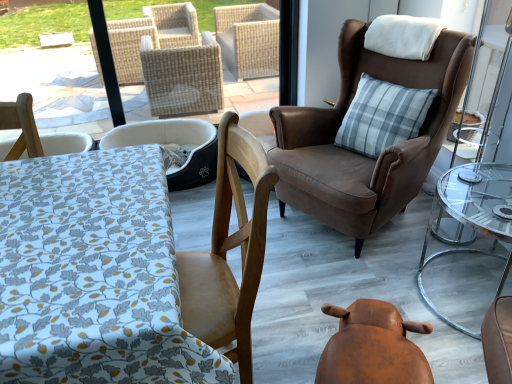
What do you see at coordinates (360, 154) in the screenshot? I see `brown suede armchair at upper right, which is counted as the 1th chair, starting from the right` at bounding box center [360, 154].

Locate an element on the screen. This screenshot has height=384, width=512. brown suede armchair at upper right, the 3th chair viewed from the left is located at coordinates (360, 154).

What are the coordinates of `clear glass table at right` in the screenshot? It's located at (473, 216).

At what (x,y) coordinates should I click in order to perform the action: click on white fabric pet bed at center, the third chair viewed from the right. Please return your answer as a coordinate pair (x, y). Looking at the image, I should click on (174, 143).

Identify the location of brown leather swivel chair at lower center. The height and width of the screenshot is (384, 512). (372, 347).

Describe the element at coordinates (382, 116) in the screenshot. I see `gray plaid pillow at upper right` at that location.

The width and height of the screenshot is (512, 384). I want to click on brown suede armchair at upper right, which is counted as the 1th chair, starting from the right, so tap(360, 154).

Looking at this image, in the image, is brown leather swivel chair at lower center on the left side or the right side of clear glass table at right?

Clearly, brown leather swivel chair at lower center is on the left of clear glass table at right in the image.

Identify the location of table that is behind the brown leather swivel chair at lower center. This screenshot has width=512, height=384. (473, 216).

Which of these two, brown leather swivel chair at lower center or clear glass table at right, is wider?

Wider between the two is clear glass table at right.

Does brown leather swivel chair at lower center have a smaller size compared to clear glass table at right?

Yes.

This screenshot has height=384, width=512. Find the location of `the 2nd chair behind the wooden chair at left, acting as the 2th chair starting from the right`. the 2nd chair behind the wooden chair at left, acting as the 2th chair starting from the right is located at coordinates (174, 143).

How far apart are wooden chair at left, which is the 2th chair from left to right, and white fabric pet bed at center, acting as the first chair starting from the left?

wooden chair at left, which is the 2th chair from left to right, and white fabric pet bed at center, acting as the first chair starting from the left, are 33.97 inches apart.

Is wooden chair at left, acting as the 2th chair starting from the right, touching white fabric pet bed at center, the third chair viewed from the right?

There is a gap between wooden chair at left, acting as the 2th chair starting from the right, and white fabric pet bed at center, the third chair viewed from the right.

Where is `chair that is the 1st one when counting upward from the clear glass table at right (from the image's perspective)`? This screenshot has width=512, height=384. chair that is the 1st one when counting upward from the clear glass table at right (from the image's perspective) is located at coordinates (174, 143).

How much distance is there between clear glass table at right and white fabric pet bed at center, acting as the first chair starting from the left?

A distance of 4.57 feet exists between clear glass table at right and white fabric pet bed at center, acting as the first chair starting from the left.

Does clear glass table at right lie behind white fabric pet bed at center, acting as the first chair starting from the left?

No, the depth of clear glass table at right is less than that of white fabric pet bed at center, acting as the first chair starting from the left.

Could you tell me if gray plaid pillow at upper right is turned towards white fabric pet bed at center, acting as the first chair starting from the left?

No, gray plaid pillow at upper right is not facing towards white fabric pet bed at center, acting as the first chair starting from the left.

From a real-world perspective, which is physically above, gray plaid pillow at upper right or white fabric pet bed at center, acting as the first chair starting from the left?

From a 3D spatial view, gray plaid pillow at upper right is above.

Considering the relative sizes of gray plaid pillow at upper right and white fabric pet bed at center, acting as the first chair starting from the left, in the image provided, is gray plaid pillow at upper right smaller than white fabric pet bed at center, acting as the first chair starting from the left,?

Indeed, gray plaid pillow at upper right has a smaller size compared to white fabric pet bed at center, acting as the first chair starting from the left.

Is gray plaid pillow at upper right not within white fabric pet bed at center, acting as the first chair starting from the left?

Yes.

Considering the relative sizes of white fabric pet bed at center, the third chair viewed from the right, and gray plaid pillow at upper right in the image provided, is white fabric pet bed at center, the third chair viewed from the right, wider than gray plaid pillow at upper right?

Correct, the width of white fabric pet bed at center, the third chair viewed from the right, exceeds that of gray plaid pillow at upper right.

Is white fabric pet bed at center, acting as the first chair starting from the left, to the left or to the right of gray plaid pillow at upper right in the image?

Based on their positions, white fabric pet bed at center, acting as the first chair starting from the left, is located to the left of gray plaid pillow at upper right.

Is white fabric pet bed at center, acting as the first chair starting from the left, taller or shorter than gray plaid pillow at upper right?

Considering their sizes, white fabric pet bed at center, acting as the first chair starting from the left, has less height than gray plaid pillow at upper right.

You are a GUI agent. You are given a task and a screenshot of the screen. Output one action in this format:
    pyautogui.click(x=<x>, y=<y>)
    Task: Click on the pillow in front of the white fabric pet bed at center, the third chair viewed from the right
    The image size is (512, 384).
    Given the screenshot: What is the action you would take?
    pyautogui.click(x=382, y=116)

Is there a large distance between white fabric pet bed at center, acting as the first chair starting from the left, and brown suede armchair at upper right, the 3th chair viewed from the left?

No, there isn't a large distance between white fabric pet bed at center, acting as the first chair starting from the left, and brown suede armchair at upper right, the 3th chair viewed from the left.

Does point (140, 126) appear closer or farther from the camera than point (320, 204)?

Point (140, 126) is positioned farther from the camera compared to point (320, 204).

From the image's perspective, which is above, white fabric pet bed at center, the third chair viewed from the right, or brown suede armchair at upper right, which is counted as the 1th chair, starting from the right?

From the image's view, brown suede armchair at upper right, which is counted as the 1th chair, starting from the right, is above.

Is white fabric pet bed at center, acting as the first chair starting from the left, to the left or to the right of brown suede armchair at upper right, which is counted as the 1th chair, starting from the right, in the image?

In the image, white fabric pet bed at center, acting as the first chair starting from the left, appears on the left side of brown suede armchair at upper right, which is counted as the 1th chair, starting from the right.

Who is more distant, brown suede armchair at upper right, which is counted as the 1th chair, starting from the right, or gray plaid pillow at upper right?

gray plaid pillow at upper right is behind.

Based on the photo, from a real-world perspective, between brown suede armchair at upper right, which is counted as the 1th chair, starting from the right, and gray plaid pillow at upper right, who is vertically higher?

gray plaid pillow at upper right, from a real-world perspective.

Does brown suede armchair at upper right, which is counted as the 1th chair, starting from the right, turn towards gray plaid pillow at upper right?

Yes, brown suede armchair at upper right, which is counted as the 1th chair, starting from the right, faces towards gray plaid pillow at upper right.

Locate an element on the screen. swivel chair located underneath the clear glass table at right (from a real-world perspective) is located at coordinates (372, 347).

What are the coordinates of `chair that is on the left side of wooden chair at left, which is the 2th chair from left to right` in the screenshot? It's located at (174, 143).

From the image, which object appears to be farther from brown suede armchair at upper right, which is counted as the 1th chair, starting from the right, wooden chair at left, which is the 2th chair from left to right, or clear glass table at right?

Among the two, wooden chair at left, which is the 2th chair from left to right, is located further to brown suede armchair at upper right, which is counted as the 1th chair, starting from the right.

Based on their spatial positions, is gray plaid pillow at upper right or brown leather swivel chair at lower center closer to white fabric pet bed at center, acting as the first chair starting from the left?

gray plaid pillow at upper right.

Looking at the image, which one is located further to brown leather swivel chair at lower center, brown suede armchair at upper right, the 3th chair viewed from the left, or clear glass table at right?

Among the two, brown suede armchair at upper right, the 3th chair viewed from the left, is located further to brown leather swivel chair at lower center.

Looking at the image, which one is located further to brown suede armchair at upper right, the 3th chair viewed from the left, brown leather swivel chair at lower center or clear glass table at right?

brown leather swivel chair at lower center is positioned further to the anchor brown suede armchair at upper right, the 3th chair viewed from the left.

From the image, which object appears to be nearer to clear glass table at right, white fabric pet bed at center, the third chair viewed from the right, or wooden chair at left, which is the 2th chair from left to right?

wooden chair at left, which is the 2th chair from left to right, is closer to clear glass table at right.

From the image, which object appears to be farther from clear glass table at right, brown suede armchair at upper right, which is counted as the 1th chair, starting from the right, or white fabric pet bed at center, acting as the first chair starting from the left?

white fabric pet bed at center, acting as the first chair starting from the left, is positioned further to the anchor clear glass table at right.

Considering their positions, is wooden chair at left, acting as the 2th chair starting from the right, positioned closer to gray plaid pillow at upper right than clear glass table at right?

clear glass table at right.

From the image, which object appears to be farther from wooden chair at left, which is the 2th chair from left to right, white fabric pet bed at center, acting as the first chair starting from the left, or clear glass table at right?

clear glass table at right is further to wooden chair at left, which is the 2th chair from left to right.

At what (x,y) coordinates should I click in order to perform the action: click on chair between brown leather swivel chair at lower center and white fabric pet bed at center, the third chair viewed from the right, along the z-axis. Please return your answer as a coordinate pair (x, y). The image size is (512, 384). Looking at the image, I should click on (360, 154).

This screenshot has width=512, height=384. I want to click on swivel chair between wooden chair at left, acting as the 2th chair starting from the right, and gray plaid pillow at upper right in the front-back direction, so click(x=372, y=347).

The width and height of the screenshot is (512, 384). In order to click on swivel chair situated between white fabric pet bed at center, the third chair viewed from the right, and clear glass table at right from left to right in this screenshot , I will do `click(372, 347)`.

Find the location of a particular element. Image resolution: width=512 pixels, height=384 pixels. swivel chair situated between wooden chair at left, acting as the 2th chair starting from the right, and clear glass table at right from left to right is located at coordinates (372, 347).